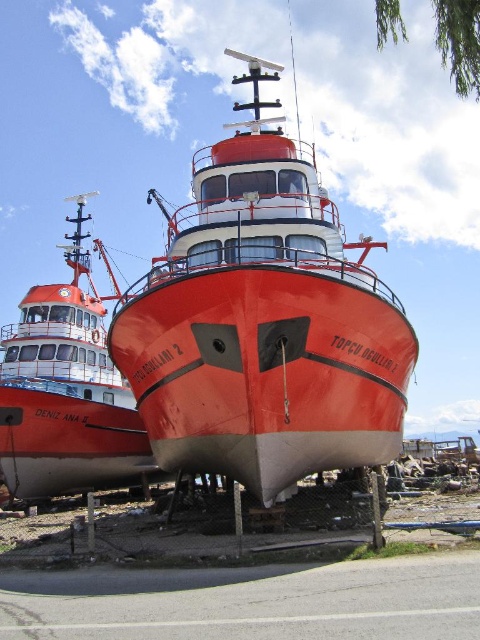
Is shiny red boat at center taller than matte red boat at center?

Indeed, shiny red boat at center has a greater height compared to matte red boat at center.

Who is more distant from viewer, (173,330) or (57,408)?

The point (57,408) is more distant.

Where is `shiny red boat at center`? The width and height of the screenshot is (480, 640). shiny red boat at center is located at coordinates (263, 323).